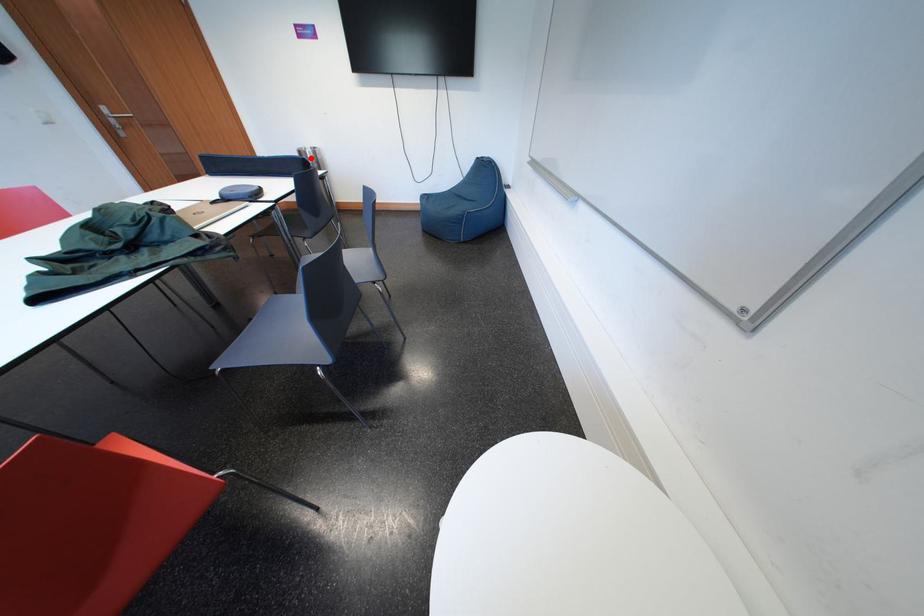
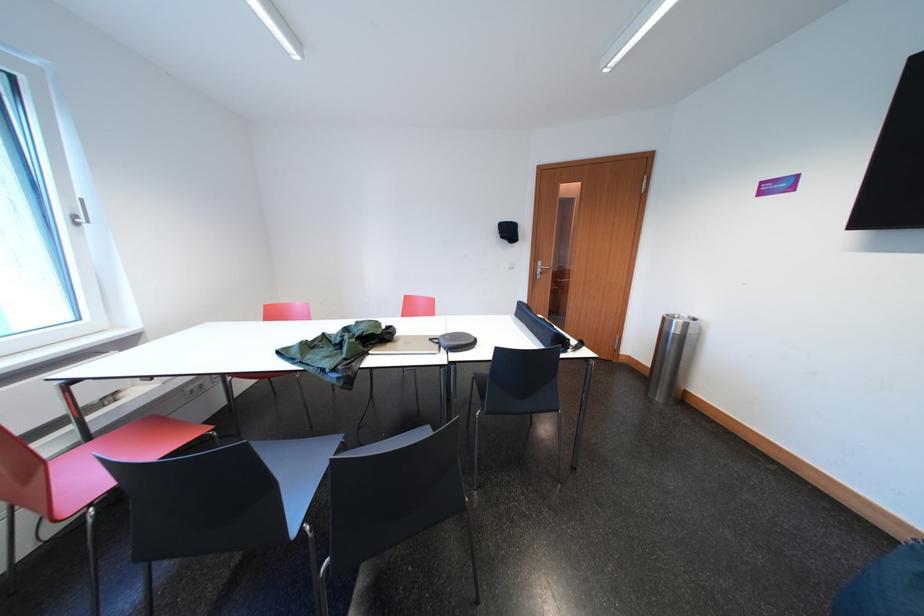
The point at the highlighted location is marked in the first image. Where is the corresponding point in the second image?

(675, 325)